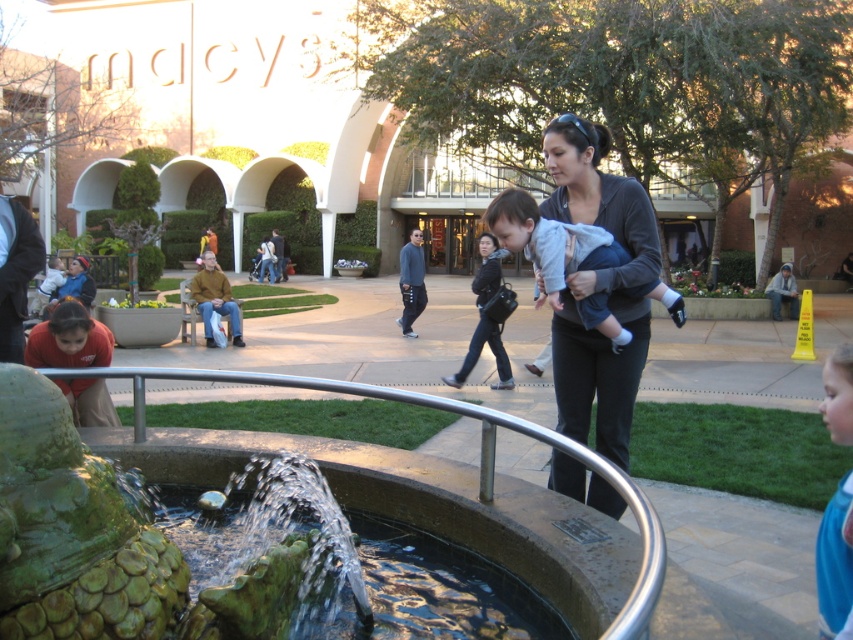
Based on the photo, you are standing in the shopping center and want to pick up both the light gray fleece at center and the blue jersey at lower right. Which item should you reach for first to grab the closer one?

The light gray fleece at center is closer to you than the blue jersey at lower right, so you should reach for the light gray fleece at center first.

From the picture: You are a photographer trying to capture a photo of the light gray fleece at center and the blue jersey at lower right. You want to ensure both items are visible in the frame. Based on their positions, which item should you focus on first to include both in your shot?

The light gray fleece at center is positioned on the left side of blue jersey at lower right, so focusing on the blue jersey at lower right first would allow you to frame both items by adjusting the camera to include the leftward positioned light gray fleece at center.

You are a photographer setting up a shot of the Macy store and its surroundings. You have to include both the light gray fleece at center and the blue jersey at lower right in your frame. Which object should you prioritize positioning closer to the center of the image to ensure it doesn,t get cropped out?

The light gray fleece at center should be positioned closer to the center of the image because it is wider than the blue jersey at lower right, making it more likely to be cropped out if placed near the edge.